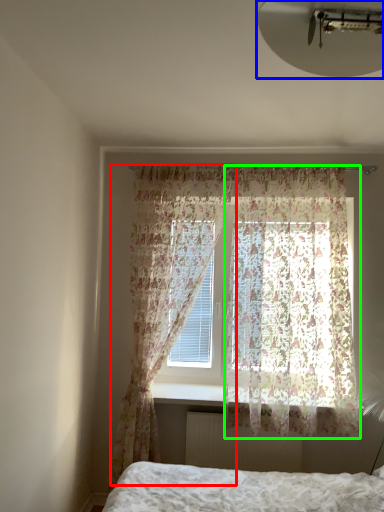
Question: Which is farther away from curtain (highlighted by a red box)? light fixture (highlighted by a blue box) or curtain (highlighted by a green box)?

Choices:
 (A) light fixture
 (B) curtain

Answer: (A)